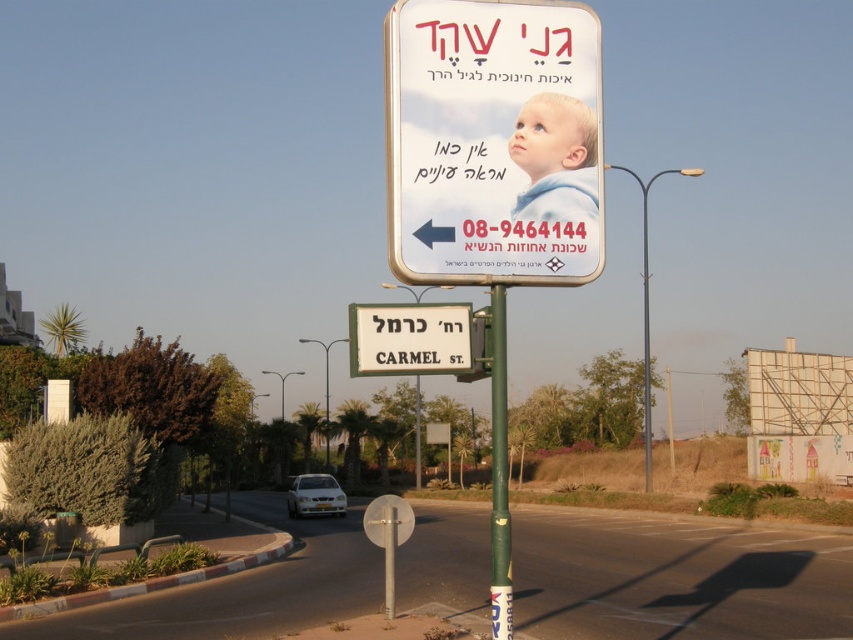
You are a delivery driver who needs to deliver a package to the address on the matte plastic sign at upper center and the white plastic street sign at center. Which sign should you look at first to determine the correct street name?

The white plastic street sign at center is larger, so you should look at it first to determine the correct street name since it occupies more space than the matte plastic sign at upper center.

You are a photographer trying to capture a photo of the light blue fabric baby at upper center and the green painted metal pole at center. If you want to ensure both objects are in focus, which one should you focus on first considering their sizes?

The light blue fabric baby at upper center has a smaller width than the green painted metal pole at center, so you should focus on the green painted metal pole at center first as it is larger and more prominent in the scene.